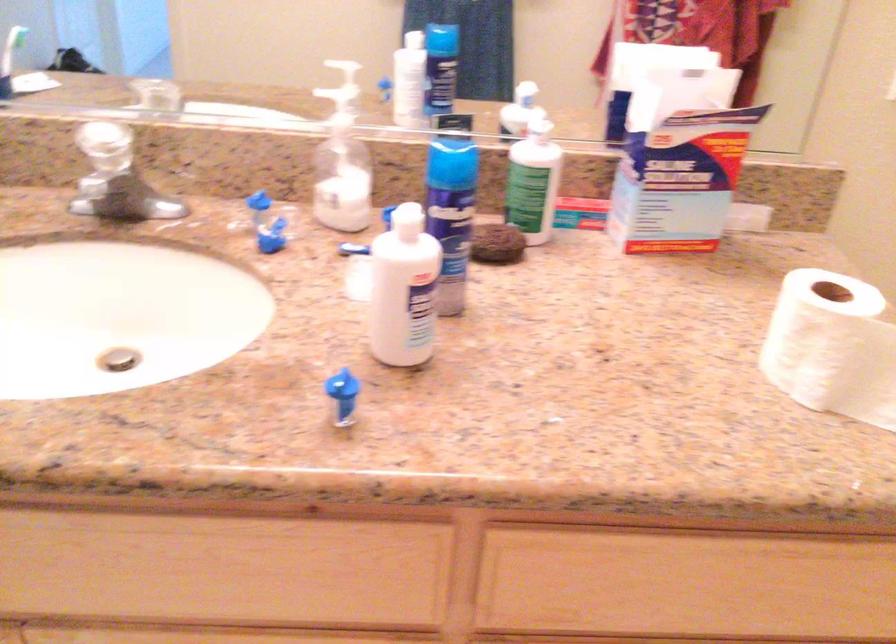
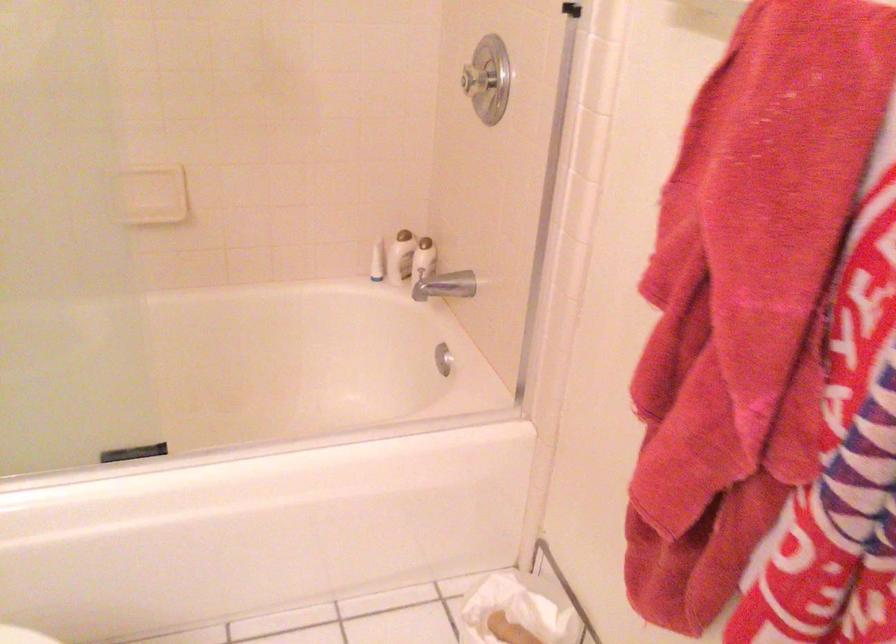
First-person continuous shooting, in which direction is the camera rotating?

The rotation direction of the camera is right-down.